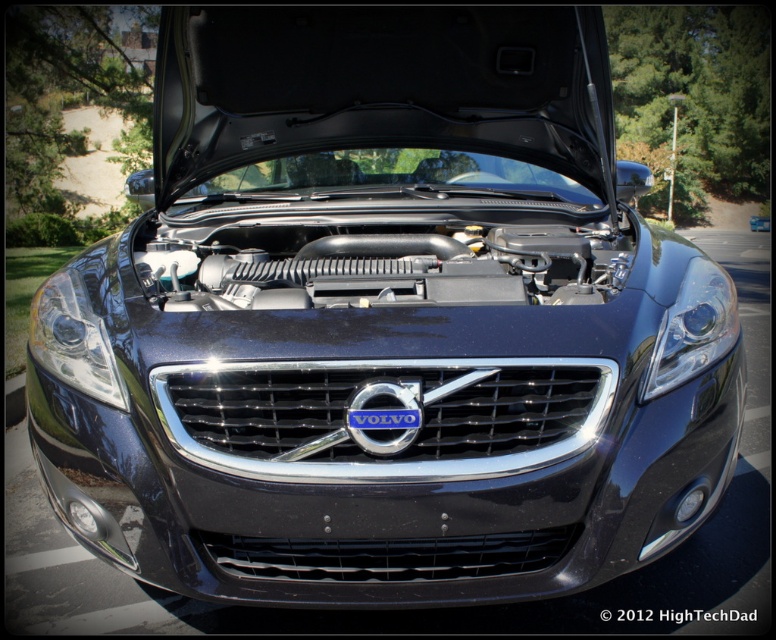
Question: Among these points, which one is nearest to the camera?

Choices:
 (A) (80, 333)
 (B) (714, 282)
 (C) (357, 420)

Answer: (C)

Question: Is satin black headlight at center smaller than blue metallic volvo emblem at center?

Choices:
 (A) no
 (B) yes

Answer: (A)

Question: Which point is closer to the camera taking this photo?

Choices:
 (A) (362, 419)
 (B) (85, 352)
 (C) (650, 384)

Answer: (A)

Question: Is satin black headlight at center closer to the viewer compared to satin black headlight at center right?

Choices:
 (A) no
 (B) yes

Answer: (B)

Question: Is satin black headlight at center right in front of blue metallic volvo emblem at center?

Choices:
 (A) no
 (B) yes

Answer: (A)

Question: Which point is closer to the camera?

Choices:
 (A) satin black headlight at center right
 (B) blue metallic volvo emblem at center
 (C) satin black headlight at center

Answer: (B)